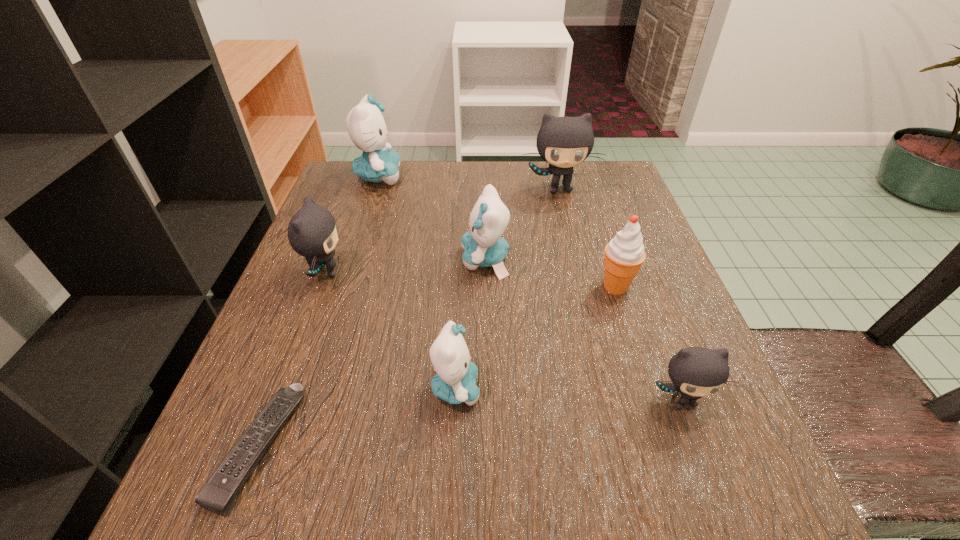
I want to click on empty location between the biggest gray kitten and the smallest blue kitten, so click(x=507, y=288).

I want to click on unoccupied position between the nearest gray kitten and the icecream, so click(x=649, y=343).

At what (x,y) coordinates should I click in order to perform the action: click on object that is the sixth closest one to the leftmost gray kitten. Please return your answer as a coordinate pair (x, y). Image resolution: width=960 pixels, height=540 pixels. Looking at the image, I should click on (624, 254).

Identify which object is the third nearest to the second smallest blue kitten. Please provide its 2D coordinates. Your answer should be formatted as a tuple, i.e. [(x, y)], where the tuple contains the x and y coordinates of a point satisfying the conditions above.

[(455, 381)]

This screenshot has width=960, height=540. I want to click on the fourth closest kitten to the remote control, so click(x=695, y=372).

At what (x,y) coordinates should I click in order to perform the action: click on kitten that is the fifth nearest to the biggest blue kitten. Please return your answer as a coordinate pair (x, y). This screenshot has height=540, width=960. Looking at the image, I should click on (695, 372).

Find the location of `blue kitten that is the third closest to the shortest object`. blue kitten that is the third closest to the shortest object is located at coordinates (365, 124).

Find the location of `the closest blue kitten to the nearest gray kitten`. the closest blue kitten to the nearest gray kitten is located at coordinates (455, 381).

Where is `gray kitten identified as the closest to the nearest blue kitten`? gray kitten identified as the closest to the nearest blue kitten is located at coordinates (312, 232).

Where is `gray kitten that is the third nearest to the icecream`? This screenshot has height=540, width=960. gray kitten that is the third nearest to the icecream is located at coordinates (312, 232).